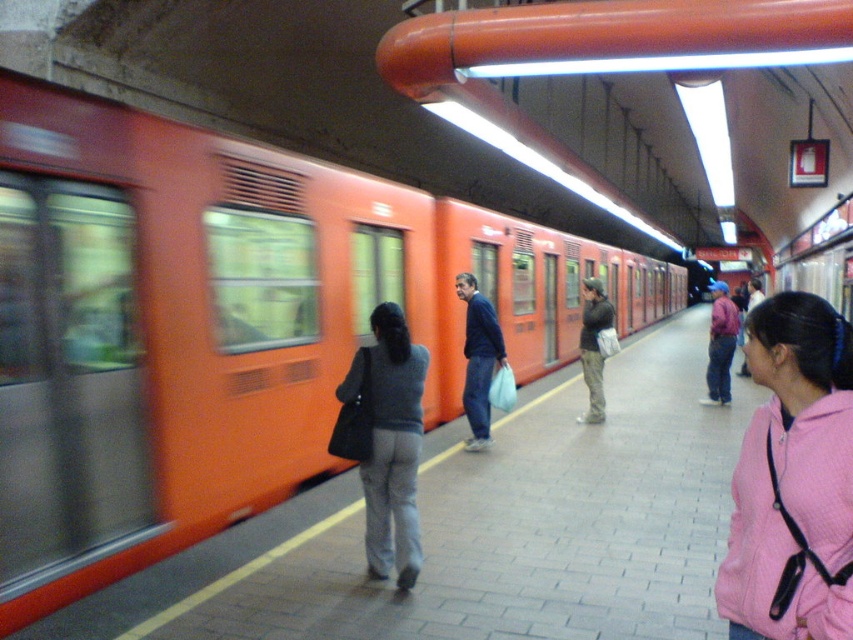
Question: Can you confirm if orange matte train at left is positioned to the right of matte gray sweater at center?

Choices:
 (A) no
 (B) yes

Answer: (B)

Question: Which point is closer to the camera?

Choices:
 (A) (119, 516)
 (B) (387, 403)
 (C) (473, 342)

Answer: (B)

Question: Which point is farther to the camera?

Choices:
 (A) matte gray sweater at center
 (B) orange matte train at left
 (C) pink fabric jacket at right
 (D) matte black jacket at center

Answer: (C)

Question: Which of these objects is positioned closest to the orange matte train at left?

Choices:
 (A) blue fabric jacket at center
 (B) pink fabric jacket at right

Answer: (A)

Question: Does orange matte train at left appear on the right side of matte gray sweater at center?

Choices:
 (A) no
 (B) yes

Answer: (B)

Question: Does matte gray sweater at center have a greater width compared to blue fabric jacket at center?

Choices:
 (A) yes
 (B) no

Answer: (A)